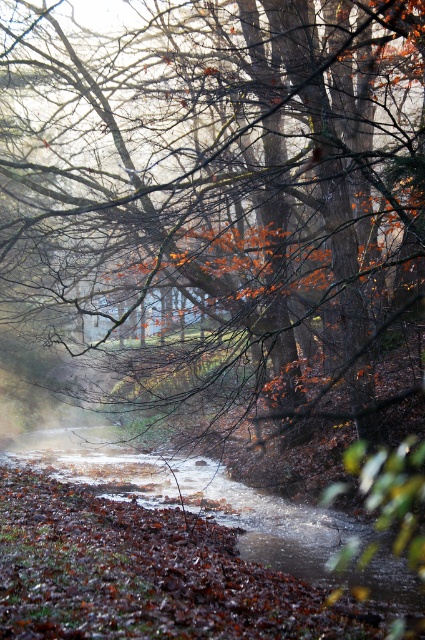
You are a hiker who wants to cross the brown leafy stream at center. You have a 20 feet long rope. Can you safely use the rope to cross the stream by tying it to the brown matte tree at center?

The brown matte tree at center is 20.66 feet away from the brown leafy stream at center. Since the rope is only 20 feet long, it is 0.66 feet shorter than needed. Therefore, the rope is not long enough to safely cross the stream by tying it to the brown matte tree at center.

You are a hiker trying to determine the tallest object between the brown matte tree at center and the brown leafy stream at center in the autumn forest scene. Which one is taller?

The brown matte tree at center is taller than the brown leafy stream at center.

You are standing in the autumn forest and want to take a photo of the brown matte tree at center. If your camera has a maximum focus range of 5 meters, will you be able to capture the tree clearly?

The brown matte tree at center is 5.27 meters away from the camera, which exceeds the camera maximum focus range of 5 meters. So you won not be able to capture the tree clearly.